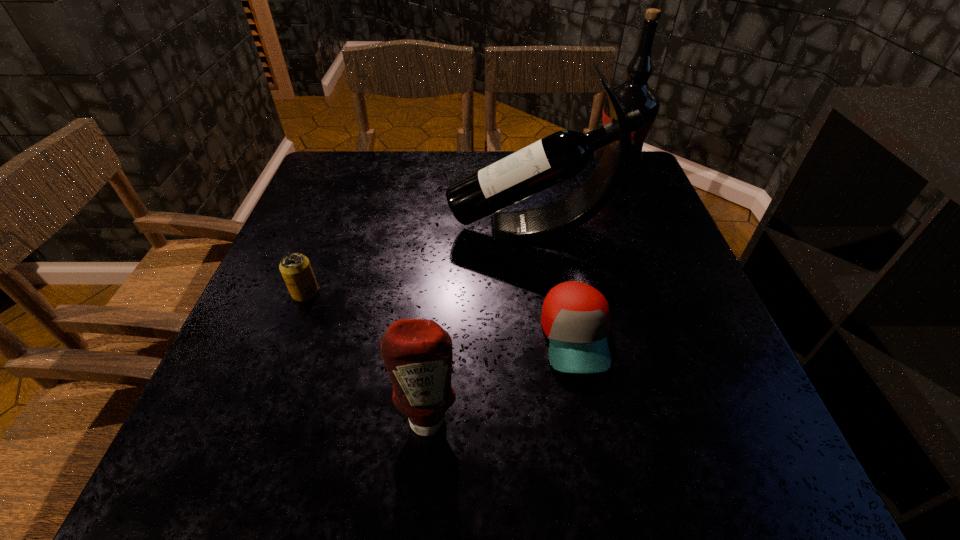
Find the location of `free location located on the stand of the second farthest object`. free location located on the stand of the second farthest object is located at coordinates (309, 230).

At what (x,y) coordinates should I click in order to perform the action: click on vacant region located on the back of the third shortest object. Please return your answer as a coordinate pair (x, y). Looking at the image, I should click on (440, 287).

Find the location of a particular element. This screenshot has height=540, width=960. vacant region located 0.130m on the front of the beer can is located at coordinates (280, 356).

Identify the location of vacant position located 0.150m at the brim of the shortest object. Image resolution: width=960 pixels, height=540 pixels. (601, 471).

Where is `object present at the far edge`? This screenshot has width=960, height=540. object present at the far edge is located at coordinates tap(635, 93).

Where is `object present at the near edge`? object present at the near edge is located at coordinates (418, 356).

This screenshot has width=960, height=540. What are the coordinates of `object at the left edge` in the screenshot? It's located at (295, 268).

This screenshot has height=540, width=960. I want to click on object present at the far right corner, so click(635, 93).

At what (x,y) coordinates should I click in order to perform the action: click on vacant region at the far edge. Please return your answer as a coordinate pair (x, y). Looking at the image, I should click on (530, 197).

I want to click on free space at the near edge of the desktop, so click(323, 448).